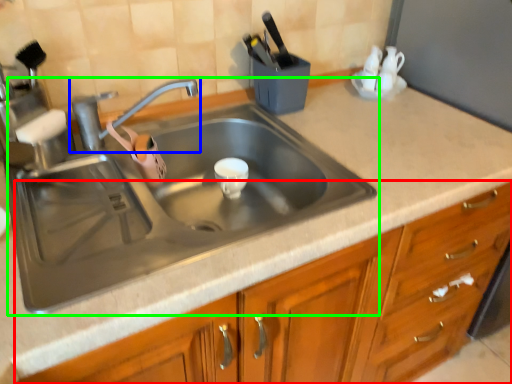
Question: Estimate the real-world distances between objects in this image. Which object is closer to cabinetry (highlighted by a red box), tap (highlighted by a blue box) or sink (highlighted by a green box)?

Choices:
 (A) tap
 (B) sink

Answer: (B)